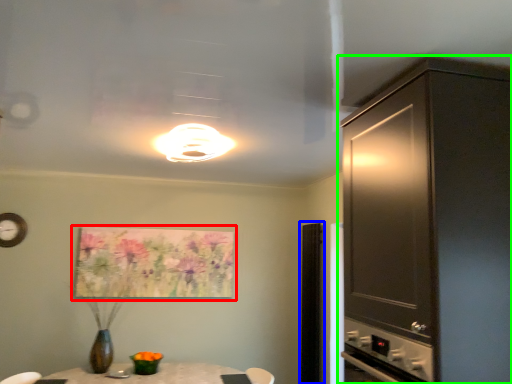
Question: Which object is the farthest from picture frame (highlighted by a red box)? Choose among these: glass door (highlighted by a blue box) or cabinetry (highlighted by a green box).

Choices:
 (A) glass door
 (B) cabinetry

Answer: (B)